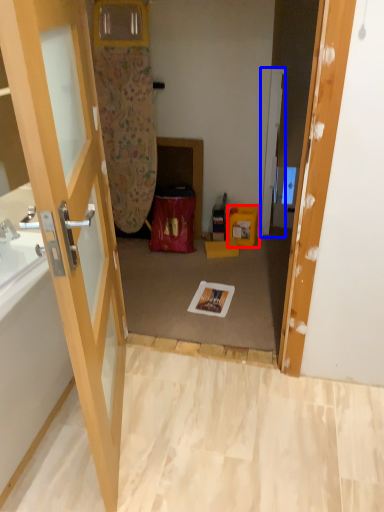
Question: Which of the following is the closest to the observer, box (highlighted by a red box) or door (highlighted by a blue box)?

Choices:
 (A) box
 (B) door

Answer: (B)